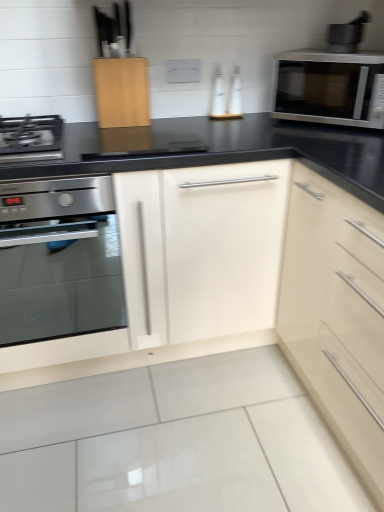
What do you see at coordinates (329, 88) in the screenshot? I see `satin silver microwave at upper right` at bounding box center [329, 88].

Where is `satin silver microwave at upper right`? satin silver microwave at upper right is located at coordinates (329, 88).

The width and height of the screenshot is (384, 512). I want to click on metallic gray mortar and pestle at upper right, so click(347, 34).

You are a GUI agent. You are given a task and a screenshot of the screen. Output one action in this format:
    pyautogui.click(x=<x>, y=<y>)
    Task: Click on the satin stainless steel oven at left
    
    Given the screenshot: What is the action you would take?
    pyautogui.click(x=59, y=259)

Identify the location of oven that appears below the satin silver microwave at upper right (from the image's perspective). The image size is (384, 512). (59, 259).

Considering their positions, is satin silver microwave at upper right located in front of or behind satin stainless steel oven at left?

In the image, satin silver microwave at upper right appears behind satin stainless steel oven at left.

Is satin stainless steel oven at left located within satin silver microwave at upper right?

No, satin stainless steel oven at left is not inside satin silver microwave at upper right.

From the image's perspective, between satin stainless steel oven at left and satin silver microwave at upper right, who is located below?

From the image's view, satin stainless steel oven at left is below.

How different are the orientations of satin stainless steel oven at left and satin silver microwave at upper right in degrees?

They differ by 47.6 degrees in their facing directions.

Between satin stainless steel oven at left and satin silver microwave at upper right, which one has smaller width?

Thinner between the two is satin silver microwave at upper right.

From a real-world perspective, is satin stainless steel oven at left on satin silver microwave at upper right?

No, from a real-world perspective, satin stainless steel oven at left is not above satin silver microwave at upper right.

Who is shorter, metallic gray mortar and pestle at upper right or satin silver microwave at upper right?

metallic gray mortar and pestle at upper right is shorter.

Which object is thinner, metallic gray mortar and pestle at upper right or satin silver microwave at upper right?

metallic gray mortar and pestle at upper right is thinner.

Could you measure the distance between metallic gray mortar and pestle at upper right and satin silver microwave at upper right?

They are 18.69 centimeters apart.

Locate an element on the screen. The image size is (384, 512). microwave oven below the metallic gray mortar and pestle at upper right (from a real-world perspective) is located at coordinates (329, 88).

Can you tell me how much metallic gray mortar and pestle at upper right and satin stainless steel oven at left differ in facing direction?

42.5 degrees.

Is metallic gray mortar and pestle at upper right aimed at satin stainless steel oven at left?

No, metallic gray mortar and pestle at upper right is not turned towards satin stainless steel oven at left.

Relative to satin stainless steel oven at left, is metallic gray mortar and pestle at upper right in front or behind?

Clearly, metallic gray mortar and pestle at upper right is behind satin stainless steel oven at left.

From a real-world perspective, who is located higher, metallic gray mortar and pestle at upper right or satin stainless steel oven at left?

metallic gray mortar and pestle at upper right, from a real-world perspective.

Considering the sizes of objects satin stainless steel oven at left and metallic gray mortar and pestle at upper right in the image provided, who is bigger, satin stainless steel oven at left or metallic gray mortar and pestle at upper right?

satin stainless steel oven at left.

Is satin stainless steel oven at left looking in the opposite direction of metallic gray mortar and pestle at upper right?

That's not correct — satin stainless steel oven at left is not looking away from metallic gray mortar and pestle at upper right.

Which point is more distant from viewer, (97, 176) or (352, 37)?

The point (352, 37) is more distant.

From a real-world perspective, is satin silver microwave at upper right physically located above or below metallic gray mortar and pestle at upper right?

From a real-world perspective, satin silver microwave at upper right is physically below metallic gray mortar and pestle at upper right.

Is point (373, 119) positioned after point (366, 18)?

No, (373, 119) is in front of (366, 18).

Is satin silver microwave at upper right next to metallic gray mortar and pestle at upper right?

There is a gap between satin silver microwave at upper right and metallic gray mortar and pestle at upper right.

Consider the image. Does satin silver microwave at upper right have a lesser width compared to metallic gray mortar and pestle at upper right?

Incorrect, the width of satin silver microwave at upper right is not less than that of metallic gray mortar and pestle at upper right.

Identify the location of oven below the satin silver microwave at upper right (from a real-world perspective). (59, 259).

I want to click on microwave oven lying on the right of satin stainless steel oven at left, so click(329, 88).

Considering their positions, is satin stainless steel oven at left positioned further to metallic gray mortar and pestle at upper right than satin silver microwave at upper right?

satin stainless steel oven at left lies further to metallic gray mortar and pestle at upper right than the other object.

From the image, which object appears to be farther from metallic gray mortar and pestle at upper right, satin silver microwave at upper right or satin stainless steel oven at left?

The object further to metallic gray mortar and pestle at upper right is satin stainless steel oven at left.

Based on their spatial positions, is metallic gray mortar and pestle at upper right or satin silver microwave at upper right further from satin stainless steel oven at left?

metallic gray mortar and pestle at upper right is further to satin stainless steel oven at left.

Considering their positions, is metallic gray mortar and pestle at upper right positioned closer to satin silver microwave at upper right than satin stainless steel oven at left?

The object closer to satin silver microwave at upper right is metallic gray mortar and pestle at upper right.

Which object lies further to the anchor point satin stainless steel oven at left, satin silver microwave at upper right or metallic gray mortar and pestle at upper right?

Based on the image, metallic gray mortar and pestle at upper right appears to be further to satin stainless steel oven at left.

Based on their spatial positions, is satin stainless steel oven at left or metallic gray mortar and pestle at upper right closer to satin silver microwave at upper right?

metallic gray mortar and pestle at upper right is closer to satin silver microwave at upper right.

The width and height of the screenshot is (384, 512). In order to click on microwave oven between satin stainless steel oven at left and metallic gray mortar and pestle at upper right in this screenshot , I will do click(x=329, y=88).